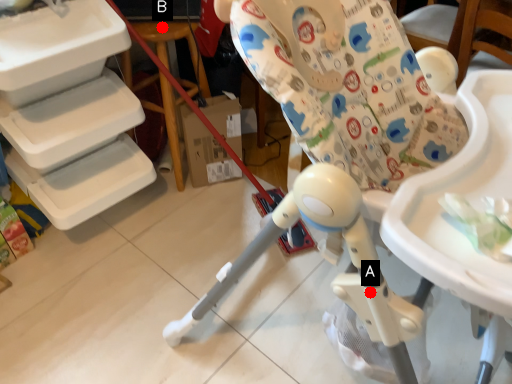
Question: Two points are circled on the image, labeled by A and B beside each circle. Which point is closer to the camera?

Choices:
 (A) A is closer
 (B) B is closer

Answer: (A)